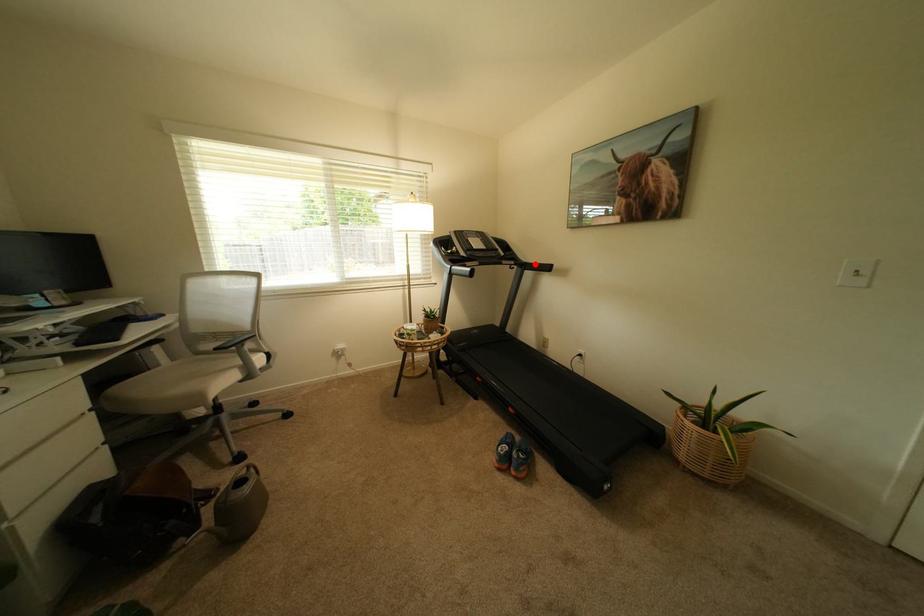
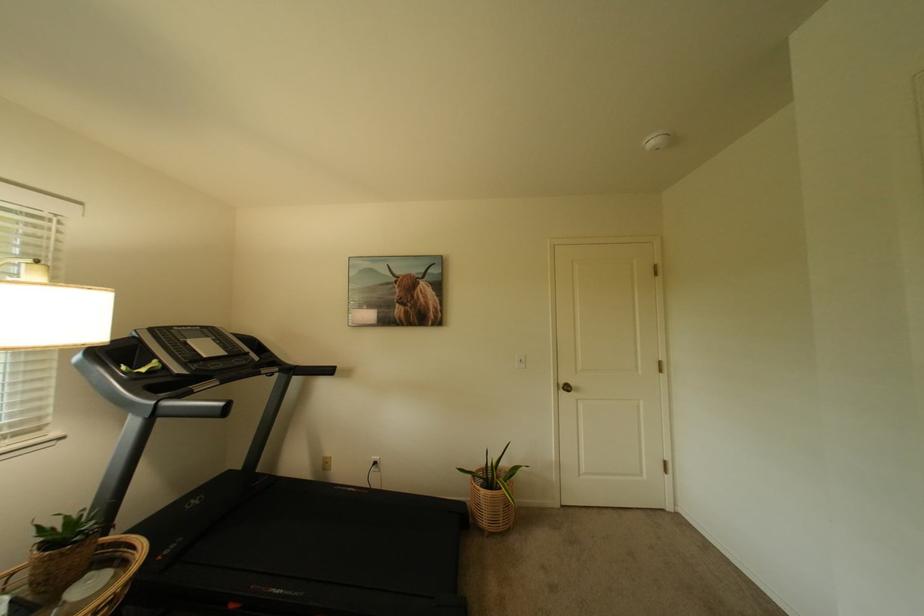
Question: A red point is marked in image1. In image2, is the corresponding 3D point closer to the camera or farther? Reply with the corresponding letter.

Choices:
 (A) The corresponding 3D point is closer.
 (B) The corresponding 3D point is farther.

Answer: (B)